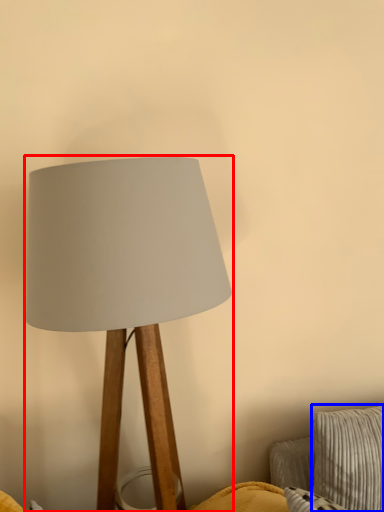
Question: Which point is further to the camera, lamp (highlighted by a red box) or pillow (highlighted by a blue box)?

Choices:
 (A) lamp
 (B) pillow

Answer: (B)